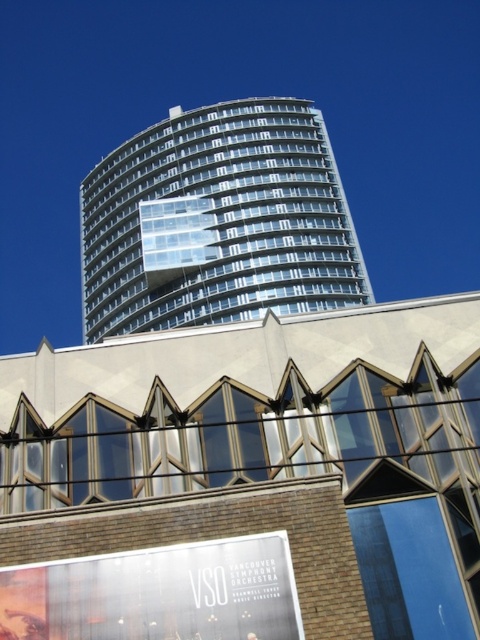
Who is taller, transparent glass building at upper center or white glossy billboard at lower center?

transparent glass building at upper center

Between point (167, 323) and point (44, 616), which one is positioned in front?

Point (44, 616) is more forward.

This screenshot has height=640, width=480. What are the coordinates of `transparent glass building at upper center` in the screenshot? It's located at (217, 221).